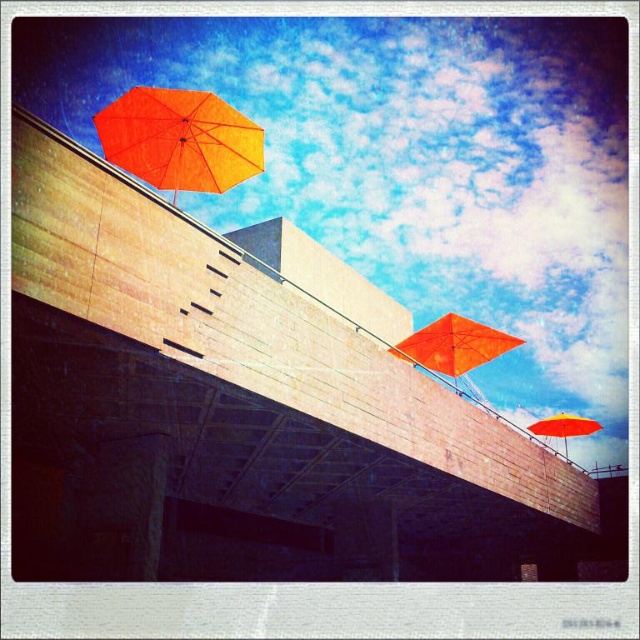
You are standing in front of the modern building and see the orange matte umbrella at upper left and the orange matte umbrella at center. Which umbrella is positioned closer to you?

The orange matte umbrella at upper left is closer to the viewer than the orange matte umbrella at center.

You are standing at a point 13.83 meters away from the point marked at coordinates point [252,172]. Given that the modern building with textured facade is in the foreground, can you estimate how far you are from the building?

Since the point marked at coordinates point [252,172] is 13.83 meters away from you, and the modern building with textured facade is in the foreground, you are likely closer than 13.83 meters to the building.